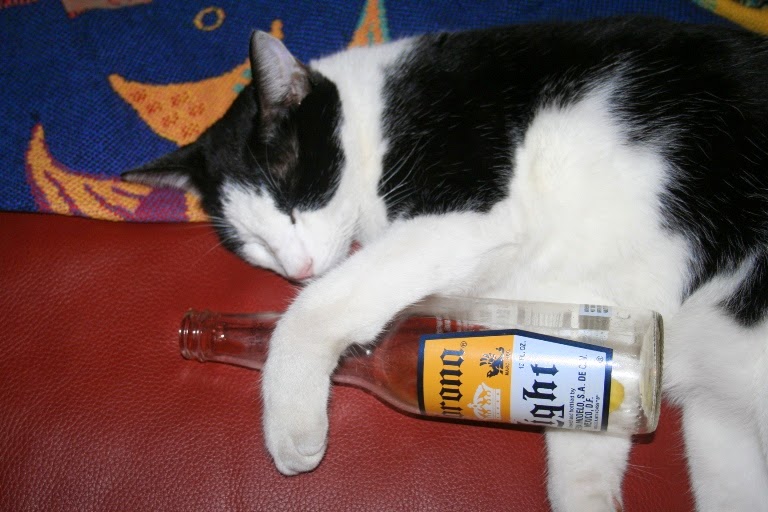
This screenshot has width=768, height=512. I want to click on tapestry, so click(83, 74).